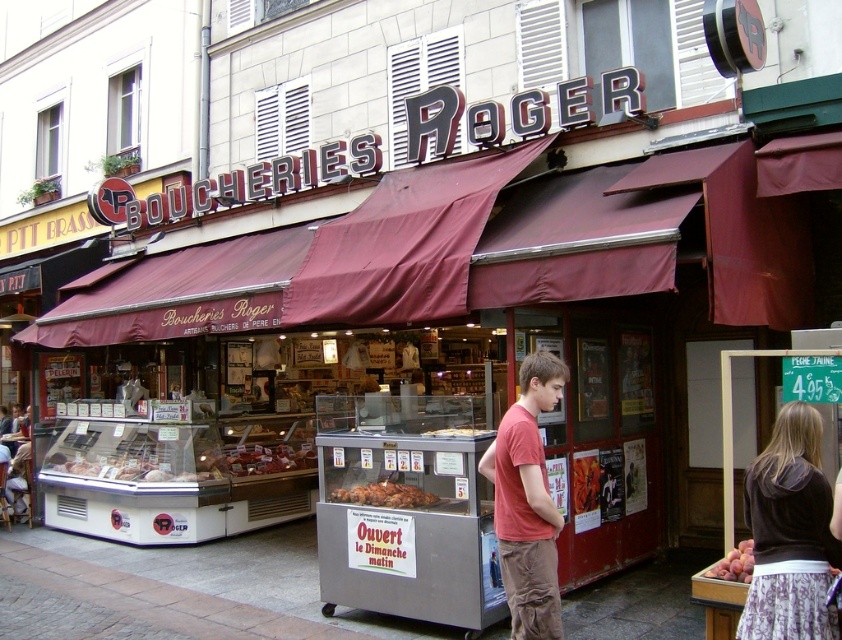
Question: Which of the following is the closest to the observer?

Choices:
 (A) velvet brown hoodie at center right
 (B) golden brown croissant at center
 (C) smooth red apples at lower right

Answer: (A)

Question: Does smooth red apples at lower right appear under matte plastic tray at center?

Choices:
 (A) yes
 (B) no

Answer: (A)

Question: Does golden brown croissant at center appear on the right side of matte plastic tray at center?

Choices:
 (A) yes
 (B) no

Answer: (B)

Question: Considering the real-world distances, which object is closest to the velvet brown hoodie at center right?

Choices:
 (A) matte plastic tray at center
 (B) matte red t-shirt at center
 (C) smooth red apples at lower right
 (D) matte brown meat at center

Answer: (C)

Question: Which object appears farthest from the camera in this image?

Choices:
 (A) matte brown meat at center
 (B) velvet brown hoodie at center right

Answer: (A)

Question: Is golden brown croissant at center behind matte plastic tray at center?

Choices:
 (A) no
 (B) yes

Answer: (B)